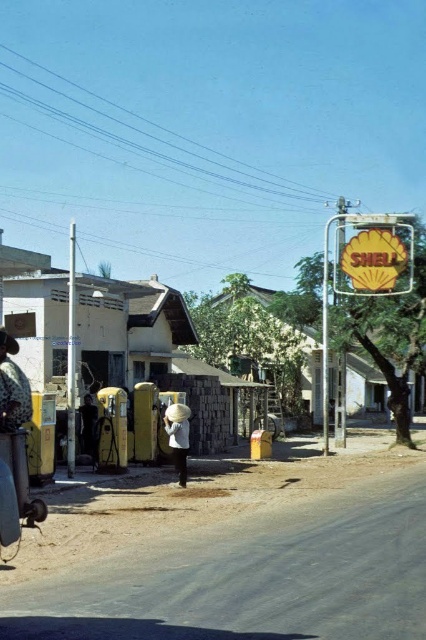
Can you confirm if white fabric basket at center is positioned below light brown straw hat at center?

No, white fabric basket at center is not below light brown straw hat at center.

Image resolution: width=426 pixels, height=640 pixels. Identify the location of white fabric basket at center. (178, 436).

I want to click on white fabric basket at center, so click(178, 436).

How far apart are spotted fabric hat at left and white fabric basket at center?

spotted fabric hat at left is 9.31 meters from white fabric basket at center.

I want to click on spotted fabric hat at left, so click(x=13, y=387).

Identify the location of spotted fabric hat at left. This screenshot has width=426, height=640. (13, 387).

This screenshot has width=426, height=640. Describe the element at coordinates (13, 387) in the screenshot. I see `spotted fabric hat at left` at that location.

Is spotted fabric hat at left shorter than light brown straw hat at center?

Correct, spotted fabric hat at left is not as tall as light brown straw hat at center.

Identify the location of spotted fabric hat at left. The width and height of the screenshot is (426, 640). (13, 387).